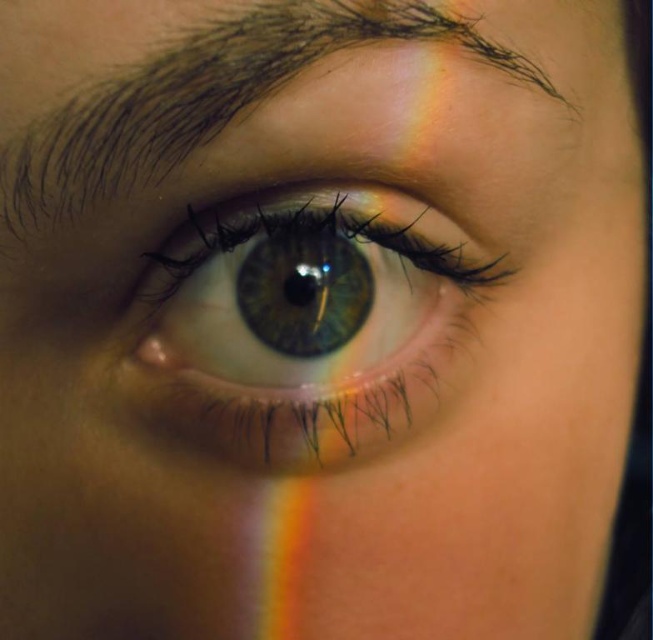
Question: Can you confirm if green iridescent eye at center is positioned to the left of brown matte eyebrow at upper center?

Choices:
 (A) yes
 (B) no

Answer: (B)

Question: Does green iridescent eye at center have a greater width compared to brown matte eyebrow at upper center?

Choices:
 (A) no
 (B) yes

Answer: (A)

Question: Is green iridescent eye at center smaller than brown matte eyebrow at upper center?

Choices:
 (A) no
 (B) yes

Answer: (B)

Question: Which object is closer to the camera taking this photo?

Choices:
 (A) brown matte eyebrow at upper center
 (B) green iridescent eye at center

Answer: (A)